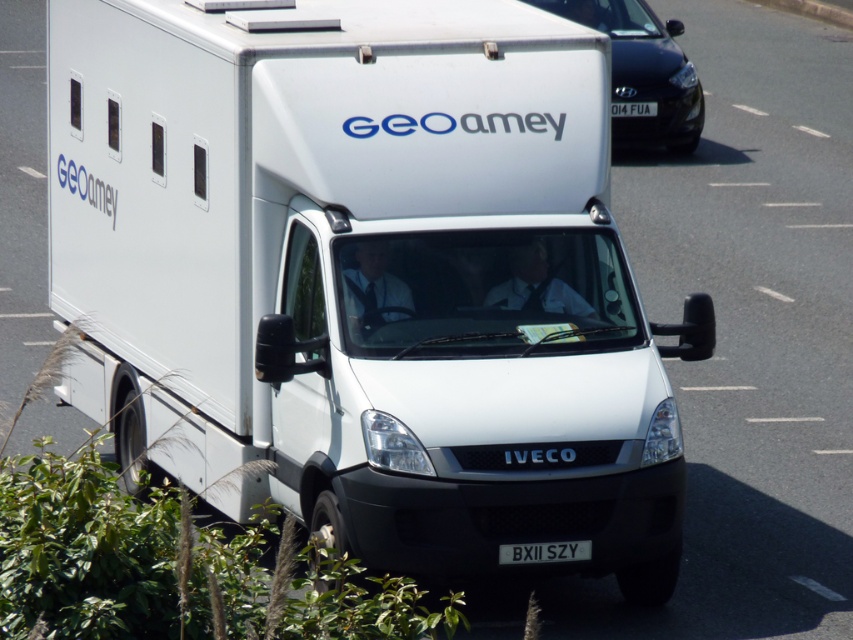
Question: Does black glossy car at upper right appear on the left side of black plastic license plate at center?

Choices:
 (A) no
 (B) yes

Answer: (A)

Question: Observing the image, what is the correct spatial positioning of black glossy car at upper right in reference to white plastic license plate at center?

Choices:
 (A) below
 (B) above

Answer: (B)

Question: Which object is farther from the camera taking this photo?

Choices:
 (A) white plastic license plate at center
 (B) black glossy car at upper right

Answer: (A)

Question: Does black glossy car at upper right have a smaller size compared to black plastic license plate at center?

Choices:
 (A) yes
 (B) no

Answer: (B)

Question: Which object is closer to the camera taking this photo?

Choices:
 (A) black plastic license plate at center
 (B) white plastic license plate at center

Answer: (A)

Question: Which object is the closest to the white plastic license plate at center?

Choices:
 (A) black plastic license plate at center
 (B) black glossy car at upper right

Answer: (B)